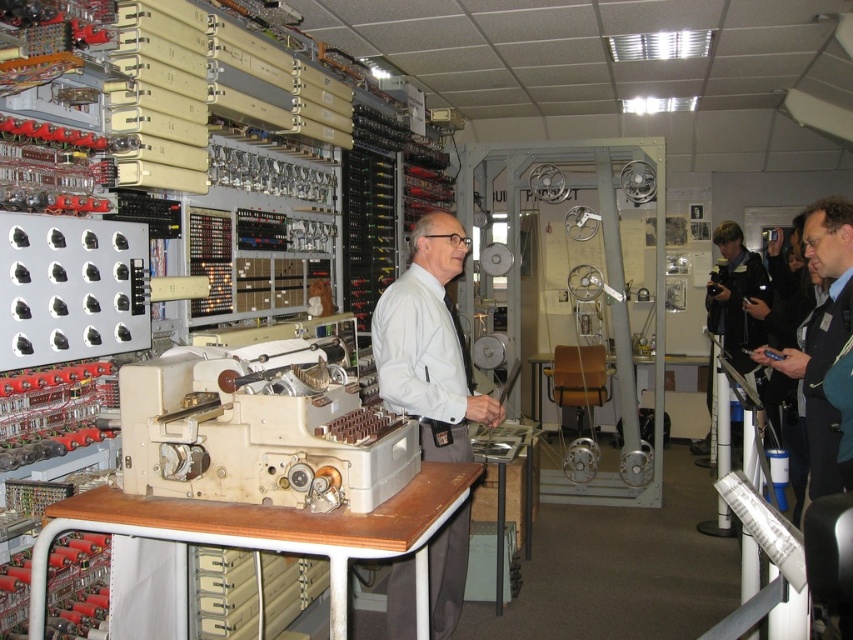
Question: Does dark blue jacket at right have a lesser width compared to black leather jacket at right?

Choices:
 (A) no
 (B) yes

Answer: (A)

Question: Which is farther from the dark blue jacket at right?

Choices:
 (A) black leather jacket at right
 (B) beige plastic typewriter at center
 (C) white matte shirt at center

Answer: (A)

Question: Which of the following is the closest to the observer?

Choices:
 (A) (160, 490)
 (B) (708, 406)
 (C) (816, 326)

Answer: (A)

Question: Is beige plastic typewriter at center wider than white matte shirt at center?

Choices:
 (A) yes
 (B) no

Answer: (A)

Question: Can you confirm if beige plastic typewriter at center is positioned above dark blue jacket at right?

Choices:
 (A) no
 (B) yes

Answer: (B)

Question: Which object is positioned closest to the dark blue jacket at right?

Choices:
 (A) white matte shirt at center
 (B) black leather jacket at right

Answer: (A)